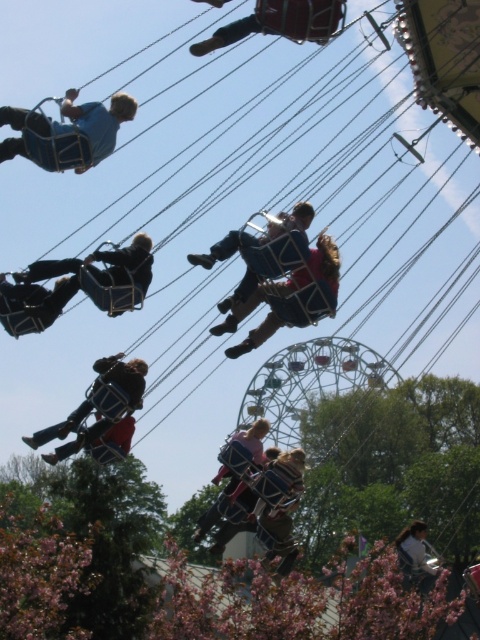
You are standing at the entrance of the amusement park and want to take a photo of both the matte blue chair at center and the light brown fabric swing at lower right. Which object should you position closer to the camera to ensure both are visible in the frame?

You should position the matte blue chair at center closer to the camera because it is in front of the light brown fabric swing at lower right, so placing it nearer will ensure both are visible without one blocking the other.

You are a photographer standing at the entrance of the fairground. You want to take a photo of the metallic blue helmet at upper center. Where should you aim your camera to capture it?

You should aim your camera at point (280, 22) to capture the metallic blue helmet at upper center.